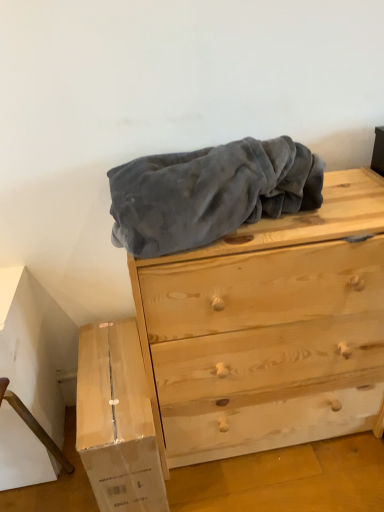
The height and width of the screenshot is (512, 384). In order to click on light brown wood chest of drawers at center in this screenshot , I will do [x=269, y=330].

The height and width of the screenshot is (512, 384). What do you see at coordinates (269, 330) in the screenshot?
I see `light brown wood chest of drawers at center` at bounding box center [269, 330].

Measure the distance between white cardboard box at lower left and camera.

white cardboard box at lower left is 87.45 centimeters away from camera.

The image size is (384, 512). What do you see at coordinates (117, 420) in the screenshot? I see `white cardboard box at lower left` at bounding box center [117, 420].

Where is `white cardboard box at lower left`? The image size is (384, 512). white cardboard box at lower left is located at coordinates (117, 420).

The width and height of the screenshot is (384, 512). Identify the location of light brown wood chest of drawers at center. (269, 330).

Based on their positions, is white cardboard box at lower left located to the left or right of light brown wood chest of drawers at center?

white cardboard box at lower left is positioned on light brown wood chest of drawers at center's left side.

Does white cardboard box at lower left lie behind light brown wood chest of drawers at center?

Yes.

Does point (142, 409) lie in front of point (254, 437)?

Yes, it is.

From the image's perspective, which object appears higher, white cardboard box at lower left or light brown wood chest of drawers at center?

light brown wood chest of drawers at center appears higher in the image.

From a real-world perspective, who is located higher, white cardboard box at lower left or light brown wood chest of drawers at center?

In real-world perspective, light brown wood chest of drawers at center is above.

Considering the relative sizes of white cardboard box at lower left and light brown wood chest of drawers at center in the image provided, is white cardboard box at lower left wider than light brown wood chest of drawers at center?

Correct, the width of white cardboard box at lower left exceeds that of light brown wood chest of drawers at center.

From their relative heights in the image, would you say white cardboard box at lower left is taller or shorter than light brown wood chest of drawers at center?

white cardboard box at lower left is shorter than light brown wood chest of drawers at center.

In the scene shown: Considering the sizes of objects white cardboard box at lower left and light brown wood chest of drawers at center in the image provided, who is bigger, white cardboard box at lower left or light brown wood chest of drawers at center?

Bigger between the two is light brown wood chest of drawers at center.

Is white cardboard box at lower left spatially inside light brown wood chest of drawers at center, or outside of it?

The correct answer is: outside.

Is white cardboard box at lower left touching light brown wood chest of drawers at center?

No, white cardboard box at lower left is not making contact with light brown wood chest of drawers at center.

Is white cardboard box at lower left oriented towards light brown wood chest of drawers at center?

No, white cardboard box at lower left is not turned towards light brown wood chest of drawers at center.

What's the angular difference between white cardboard box at lower left and light brown wood chest of drawers at center's facing directions?

The angle between the facing direction of white cardboard box at lower left and the facing direction of light brown wood chest of drawers at center is 0.00106 degrees.

The image size is (384, 512). Find the location of `cardboard box that is on the left side of light brown wood chest of drawers at center`. cardboard box that is on the left side of light brown wood chest of drawers at center is located at coordinates (117, 420).

Based on their positions, is light brown wood chest of drawers at center located to the left or right of white cardboard box at lower left?

From the image, it's evident that light brown wood chest of drawers at center is to the right of white cardboard box at lower left.

Considering their positions, is light brown wood chest of drawers at center located in front of or behind white cardboard box at lower left?

In the image, light brown wood chest of drawers at center appears in front of white cardboard box at lower left.

Is point (377, 364) positioned after point (98, 456)?

Yes.

From the image's perspective, is light brown wood chest of drawers at center above white cardboard box at lower left?

Yes, from the image's perspective, light brown wood chest of drawers at center is over white cardboard box at lower left.

From a real-world perspective, which is physically below, light brown wood chest of drawers at center or white cardboard box at lower left?

white cardboard box at lower left.

Does light brown wood chest of drawers at center have a greater width compared to white cardboard box at lower left?

No, light brown wood chest of drawers at center is not wider than white cardboard box at lower left.

In the scene shown: From their relative heights in the image, would you say light brown wood chest of drawers at center is taller or shorter than white cardboard box at lower left?

Considering their sizes, light brown wood chest of drawers at center has more height than white cardboard box at lower left.

Which of these two, light brown wood chest of drawers at center or white cardboard box at lower left, is smaller?

white cardboard box at lower left is smaller.

Is light brown wood chest of drawers at center completely or partially outside of white cardboard box at lower left?

That's correct, light brown wood chest of drawers at center is outside of white cardboard box at lower left.

Would you consider light brown wood chest of drawers at center to be distant from white cardboard box at lower left?

light brown wood chest of drawers at center is actually quite close to white cardboard box at lower left.

Does light brown wood chest of drawers at center turn towards white cardboard box at lower left?

No, light brown wood chest of drawers at center is not turned towards white cardboard box at lower left.

How distant is light brown wood chest of drawers at center from white cardboard box at lower left?

The distance of light brown wood chest of drawers at center from white cardboard box at lower left is 10.67 inches.

Where is `cardboard box below the light brown wood chest of drawers at center (from the image's perspective)`? cardboard box below the light brown wood chest of drawers at center (from the image's perspective) is located at coordinates (117, 420).

In order to click on the chest of drawers in front of the white cardboard box at lower left in this screenshot , I will do `click(269, 330)`.

You are a GUI agent. You are given a task and a screenshot of the screen. Output one action in this format:
    pyautogui.click(x=<x>, y=<y>)
    Task: Click on the cardboard box to the left of light brown wood chest of drawers at center
    The height and width of the screenshot is (512, 384).
    Given the screenshot: What is the action you would take?
    pyautogui.click(x=117, y=420)